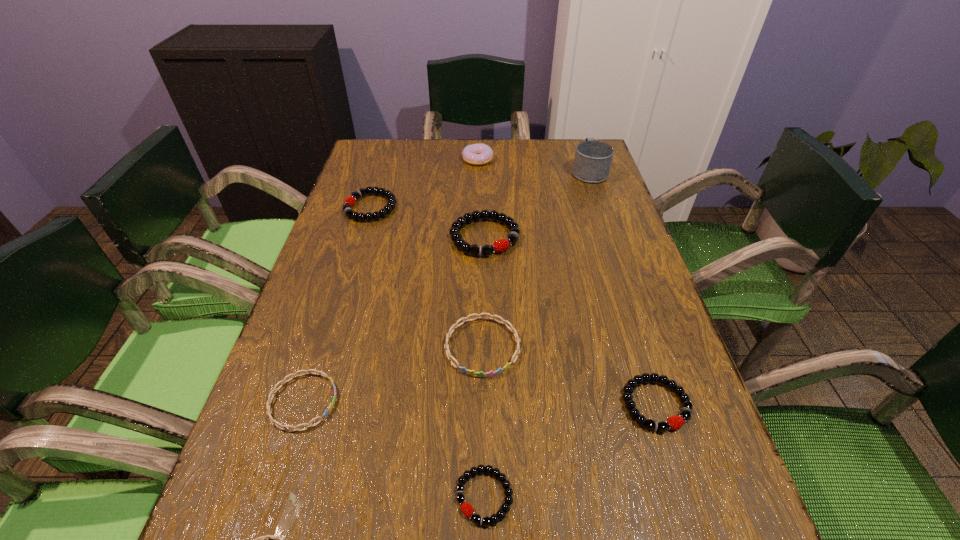
At what (x,y) coordinates should I click in order to perform the action: click on black bracelet object that ranks as the closest to the rightmost black bracelet. Please return your answer as a coordinate pair (x, y). Image resolution: width=960 pixels, height=540 pixels. Looking at the image, I should click on (466, 508).

Identify the location of black bracelet identified as the closest to the shortest object. (466, 508).

Find the location of a particular element. blue bracelet that is the closest to the nearest object is located at coordinates coord(282,427).

The image size is (960, 540). Find the location of `blue bracelet that is the closest to the second smallest blue bracelet`. blue bracelet that is the closest to the second smallest blue bracelet is located at coordinates (264, 539).

In order to click on vacant region that satisfies the following two spatial constraints: 1. on the surface of the biggest blue bracelet showing star-shaped elements; 2. on the surface of the second biggest blue bracelet showing star-shaped elements in this screenshot , I will do `click(483, 401)`.

Locate an element on the screen. The width and height of the screenshot is (960, 540). free location that satisfies the following two spatial constraints: 1. on the surface of the eighth farthest object showing star-shaped elements; 2. on the right side of the second smallest blue bracelet is located at coordinates (273, 496).

Locate an element on the screen. The image size is (960, 540). free region that satisfies the following two spatial constraints: 1. on the surface of the smallest black bracelet showing star-shaped elements; 2. on the right side of the biggest blue bracelet is located at coordinates (483, 496).